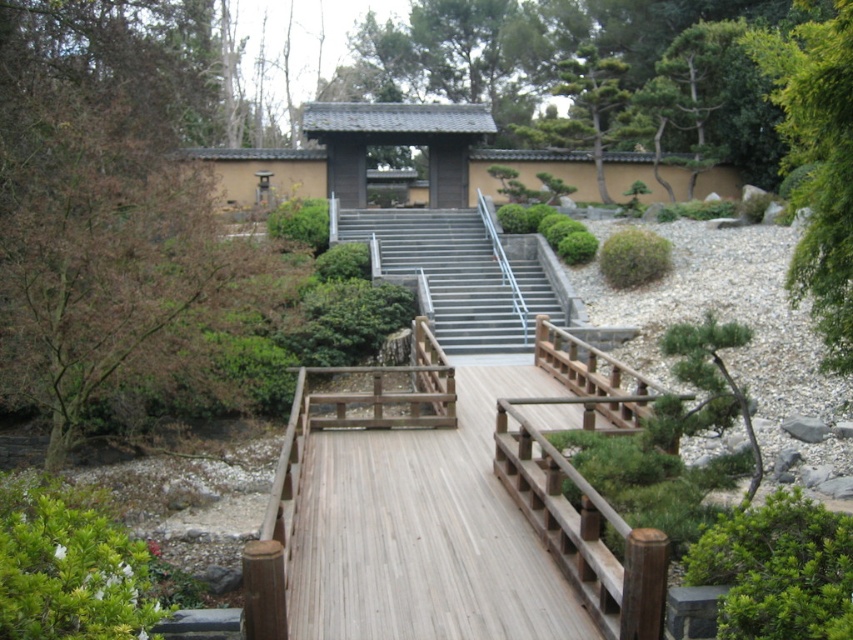
Question: Observing the image, what is the correct spatial positioning of light brown wooden bridge at center in reference to metallic gray stairs at center?

Choices:
 (A) below
 (B) above

Answer: (A)

Question: Which object is positioned closest to the green leafy tree at upper right?

Choices:
 (A) light brown wooden bridge at center
 (B) metallic gray stairs at center

Answer: (A)

Question: Can you confirm if light brown wooden bridge at center is positioned to the left of green leafy tree at upper right?

Choices:
 (A) no
 (B) yes

Answer: (B)

Question: Does light brown wooden bridge at center appear on the left side of metallic gray stairs at center?

Choices:
 (A) yes
 (B) no

Answer: (B)

Question: Which object is closer to the camera taking this photo?

Choices:
 (A) green leafy tree at upper right
 (B) metallic gray stairs at center

Answer: (A)

Question: Based on their relative distances, which object is nearer to the green leafy tree at upper right?

Choices:
 (A) metallic gray stairs at center
 (B) light brown wooden bridge at center

Answer: (B)